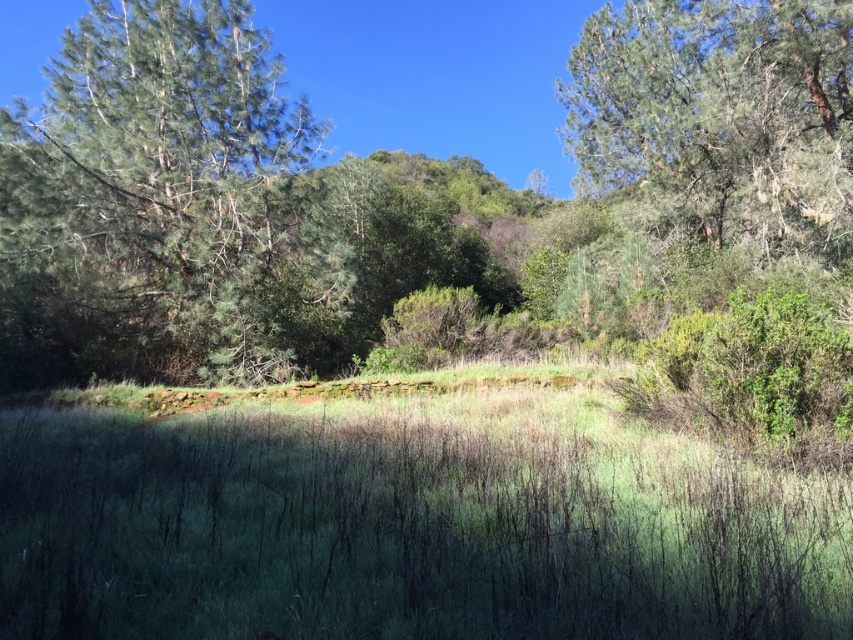
Question: Which point is farther to the camera?

Choices:
 (A) (759, 68)
 (B) (511, 497)
 (C) (279, 102)

Answer: (A)

Question: Estimate the real-world distances between objects in this image. Which object is closer to the green textured tree at left?

Choices:
 (A) green textured tree at upper right
 (B) green grassy at center

Answer: (B)

Question: Estimate the real-world distances between objects in this image. Which object is farther from the green grassy at center?

Choices:
 (A) green textured tree at left
 (B) green textured tree at upper right

Answer: (B)

Question: Can you confirm if green grassy at center is positioned above green textured tree at left?

Choices:
 (A) no
 (B) yes

Answer: (A)

Question: Does green textured tree at left appear over green textured tree at upper right?

Choices:
 (A) no
 (B) yes

Answer: (A)

Question: Does green grassy at center have a lesser width compared to green textured tree at upper right?

Choices:
 (A) yes
 (B) no

Answer: (B)